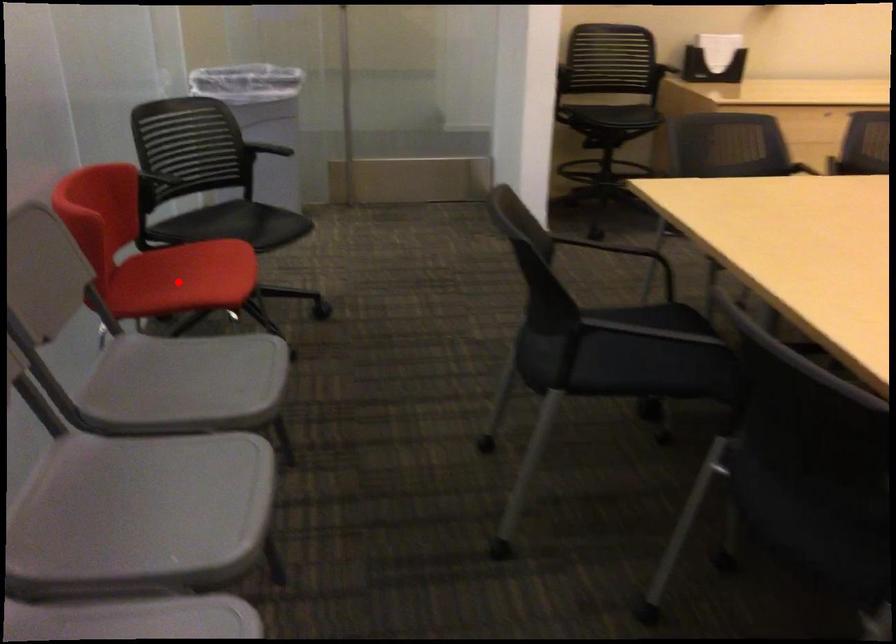
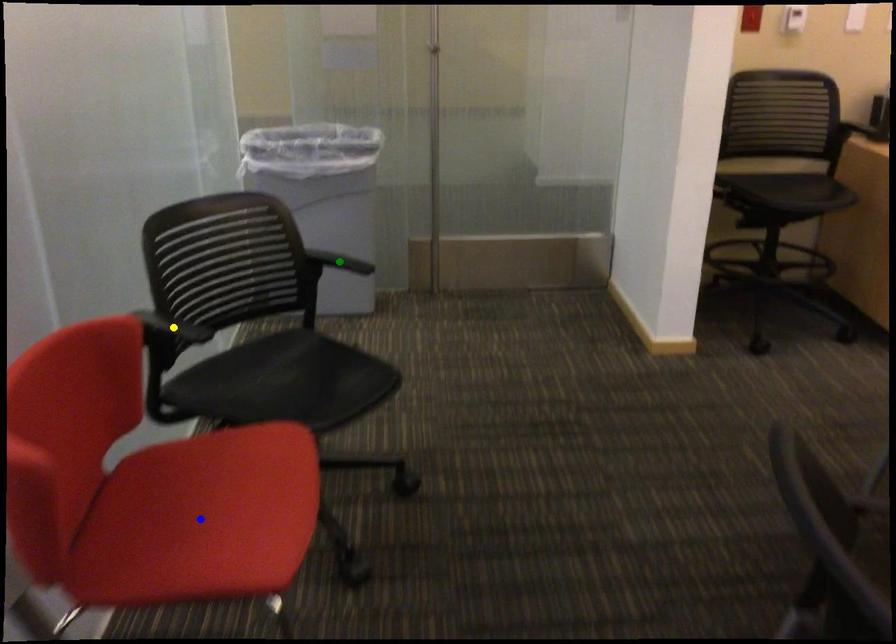
Question: I am providing you with two images of the same scene from different viewpoints. A red point is marked on the first image. You are given multiple points on the second image. Which point in image 2 is actually the same real-world point as the red point in image 1?

Choices:
 (A) blue point
 (B) yellow point
 (C) green point

Answer: (A)